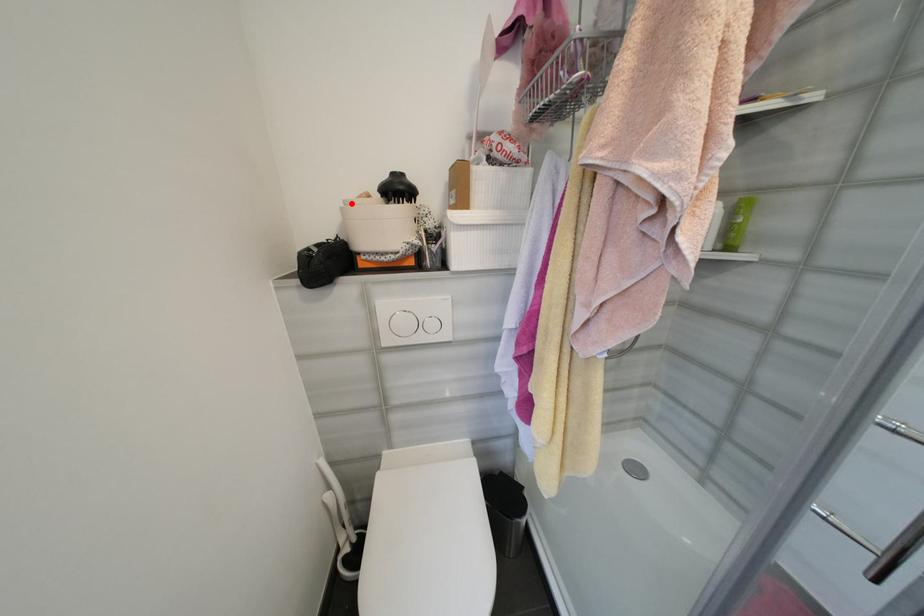
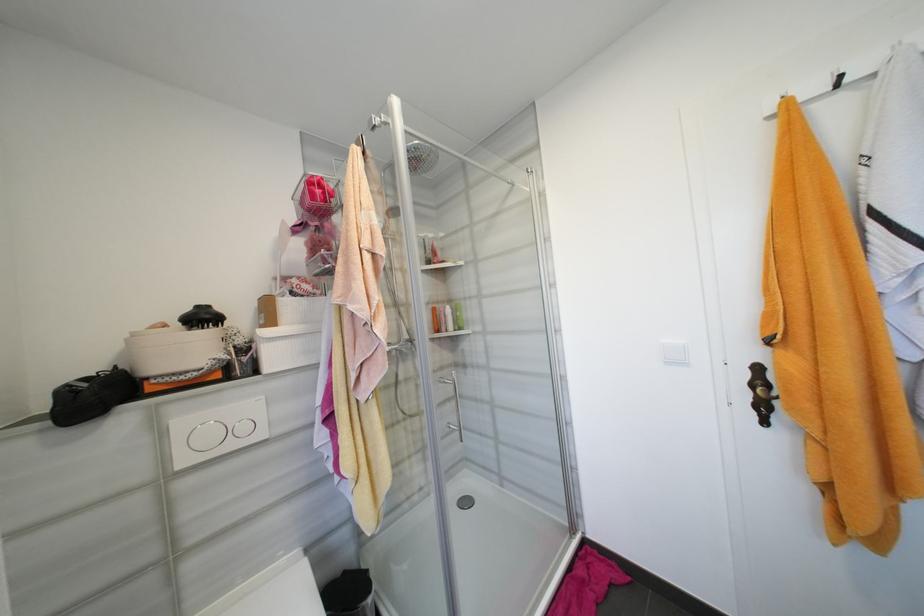
In the second image, find the point that corresponds to the highlighted location in the first image.

(140, 334)